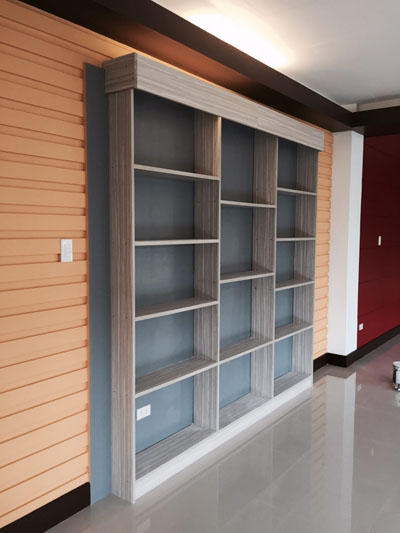
I want to click on power sockets, so click(x=359, y=326), click(x=141, y=410).